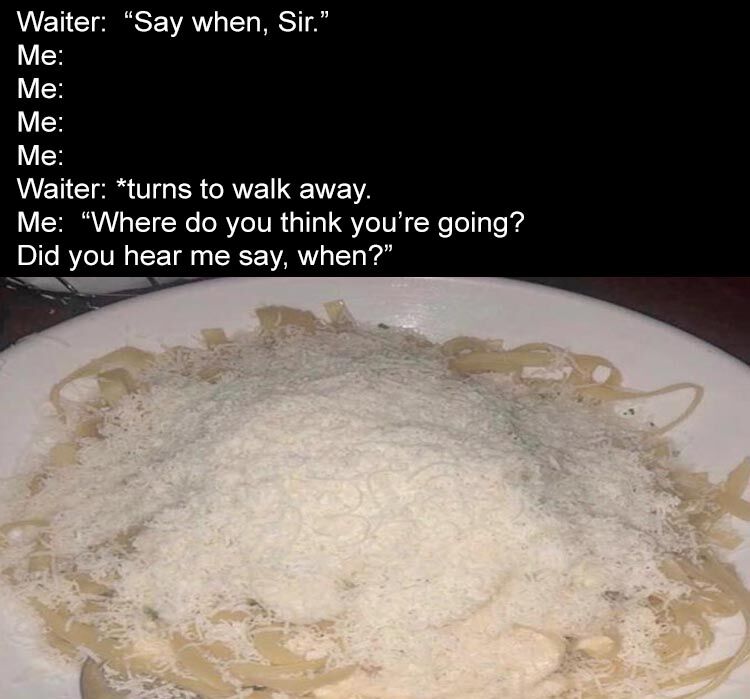
At what (x,y) coordinates should I click in order to perform the action: click on pasta bowl. Please return your answer as a coordinate pair (x, y). This screenshot has height=699, width=750. Looking at the image, I should click on (493, 323).